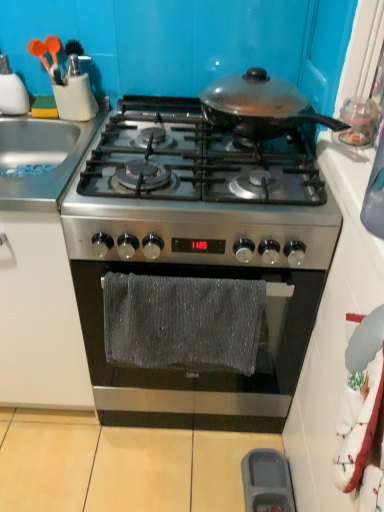
Question: In which direction should I rotate to look at stainless steel gas stove at center, which appears as the 1th gas stove when viewed from the top?

Choices:
 (A) left
 (B) right

Answer: (B)

Question: Considering the relative sizes of stainless steel gas stove at center, marked as the second gas stove in a top-to-bottom arrangement, and shiny black pan at center, positioned as the first kitchen appliance in right-to-left order, in the image provided, is stainless steel gas stove at center, marked as the second gas stove in a top-to-bottom arrangement, wider than shiny black pan at center, positioned as the first kitchen appliance in right-to-left order,?

Choices:
 (A) yes
 (B) no

Answer: (A)

Question: From a real-world perspective, is stainless steel gas stove at center, marked as the second gas stove in a top-to-bottom arrangement, over shiny black pan at center, arranged as the 2th kitchen appliance when viewed from the left?

Choices:
 (A) yes
 (B) no

Answer: (B)

Question: Is the depth of stainless steel gas stove at center, positioned as the 1th gas stove in bottom-to-top order, greater than that of shiny black pan at center, arranged as the 2th kitchen appliance when viewed from the left?

Choices:
 (A) yes
 (B) no

Answer: (A)

Question: From a real-world perspective, is stainless steel gas stove at center, positioned as the 1th gas stove in bottom-to-top order, beneath shiny black pan at center, arranged as the 2th kitchen appliance when viewed from the left?

Choices:
 (A) yes
 (B) no

Answer: (A)

Question: Is stainless steel gas stove at center, marked as the second gas stove in a top-to-bottom arrangement, closer to the viewer compared to shiny black pan at center, positioned as the first kitchen appliance in right-to-left order?

Choices:
 (A) yes
 (B) no

Answer: (B)

Question: From the image's perspective, is stainless steel gas stove at center, positioned as the 1th gas stove in bottom-to-top order, on shiny black pan at center, arranged as the 2th kitchen appliance when viewed from the left?

Choices:
 (A) no
 (B) yes

Answer: (A)

Question: From the image's perspective, is stainless steel gas stove at center, which appears as the 1th gas stove when viewed from the top, over shiny black pan at center, positioned as the first kitchen appliance in right-to-left order?

Choices:
 (A) no
 (B) yes

Answer: (A)

Question: Is stainless steel gas stove at center, which appears as the 1th gas stove when viewed from the top, wider than shiny black pan at center, arranged as the 2th kitchen appliance when viewed from the left?

Choices:
 (A) yes
 (B) no

Answer: (A)

Question: Is stainless steel gas stove at center, which appears as the 1th gas stove when viewed from the top, closer to the viewer compared to shiny black pan at center, positioned as the first kitchen appliance in right-to-left order?

Choices:
 (A) no
 (B) yes

Answer: (B)

Question: Is stainless steel gas stove at center, the second gas stove in the bottom-to-top sequence, completely or partially outside of shiny black pan at center, positioned as the first kitchen appliance in right-to-left order?

Choices:
 (A) no
 (B) yes

Answer: (B)

Question: From a real-world perspective, is stainless steel gas stove at center, which appears as the 1th gas stove when viewed from the top, physically above shiny black pan at center, arranged as the 2th kitchen appliance when viewed from the left?

Choices:
 (A) yes
 (B) no

Answer: (B)

Question: From a real-world perspective, is stainless steel gas stove at center, which appears as the 1th gas stove when viewed from the top, physically below shiny black pan at center, arranged as the 2th kitchen appliance when viewed from the left?

Choices:
 (A) no
 (B) yes

Answer: (B)

Question: Can you confirm if stainless steel sink at left is thinner than gray textured towel at center?

Choices:
 (A) yes
 (B) no

Answer: (B)